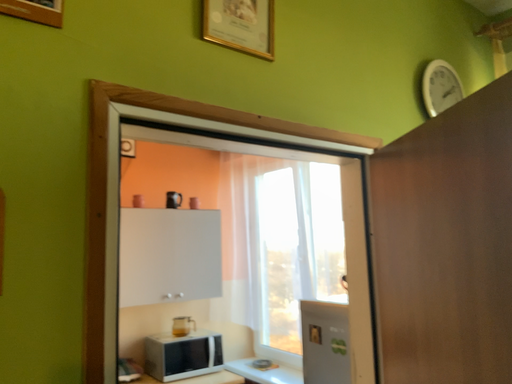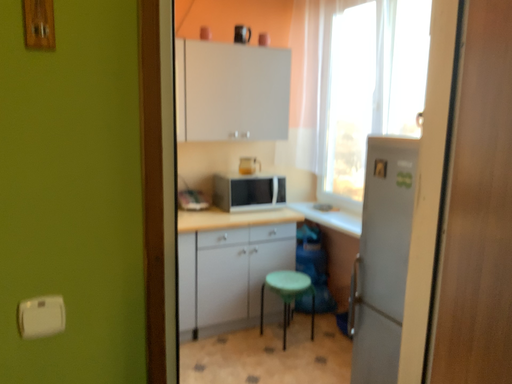
Question: Which way did the camera rotate in the video?

Choices:
 (A) rotated downward
 (B) rotated upward

Answer: (A)